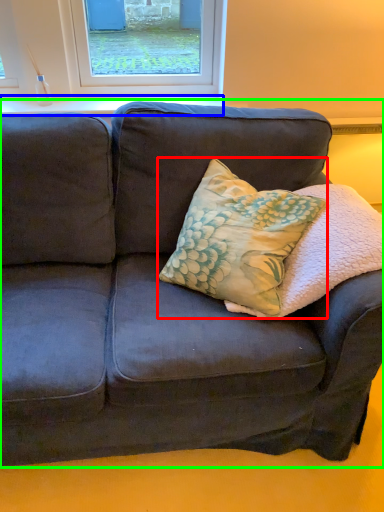
Question: Estimate the real-world distances between objects in this image. Which object is farther from throw pillow (highlighted by a red box), window sill (highlighted by a blue box) or studio couch (highlighted by a green box)?

Choices:
 (A) window sill
 (B) studio couch

Answer: (A)